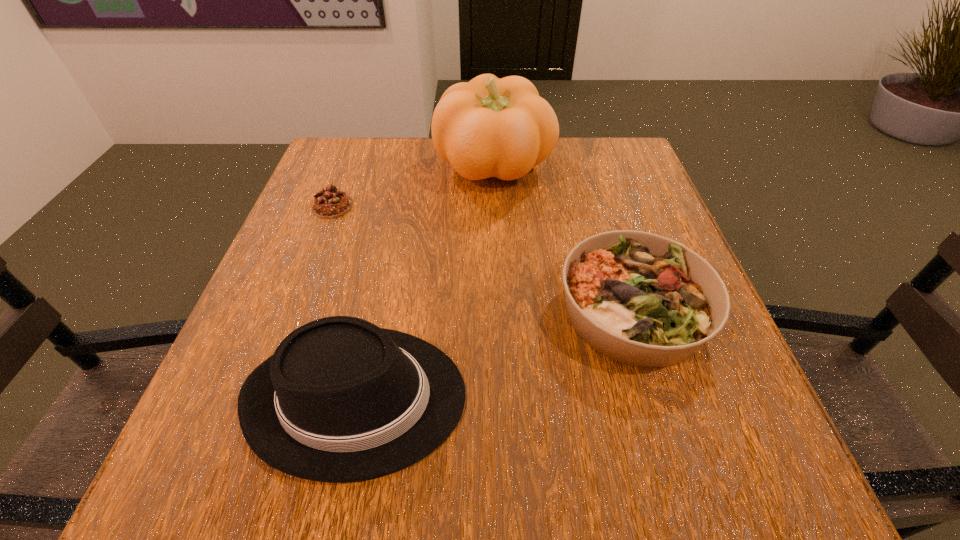
Locate an element on the screen. pumpkin is located at coordinates (488, 127).

Locate an element on the screen. fedora is located at coordinates (341, 400).

Where is `the second shortest object`? This screenshot has height=540, width=960. the second shortest object is located at coordinates (642, 299).

Find the location of a particular element. The height and width of the screenshot is (540, 960). chocolate cake is located at coordinates (330, 203).

Locate an element on the screen. vacant space located on the left of the pumpkin is located at coordinates (363, 167).

This screenshot has width=960, height=540. I want to click on free space located on the front-facing side of the third shortest object, so click(592, 397).

Where is `vacant area situated 0.400m on the back of the salad plate`? The width and height of the screenshot is (960, 540). vacant area situated 0.400m on the back of the salad plate is located at coordinates (584, 152).

This screenshot has height=540, width=960. I want to click on blank space located on the right of the shortest object, so click(397, 206).

You are a GUI agent. You are given a task and a screenshot of the screen. Output one action in this format:
    pyautogui.click(x=<x>, y=<y>)
    Task: Click on the object positioned at the far edge
    This screenshot has width=960, height=540.
    Given the screenshot: What is the action you would take?
    pyautogui.click(x=488, y=127)

Locate an element on the screen. Image resolution: width=960 pixels, height=540 pixels. object that is at the near edge is located at coordinates (x=341, y=400).